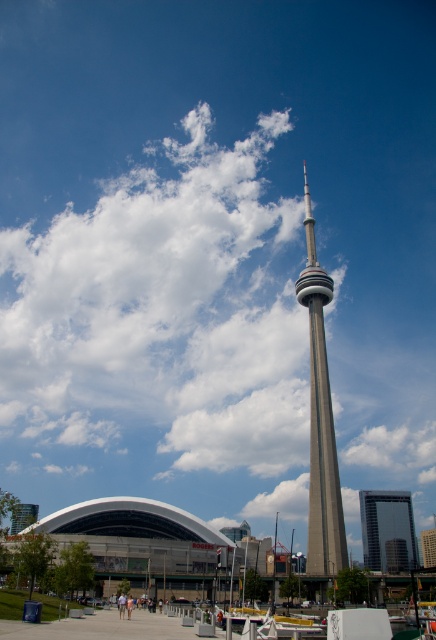
Does white fluffy cloud at upper center have a smaller size compared to silver metallic cn tower at center?

No.

How distant is white fluffy cloud at upper center from silver metallic cn tower at center?

white fluffy cloud at upper center is 63.32 meters away from silver metallic cn tower at center.

Image resolution: width=436 pixels, height=640 pixels. What do you see at coordinates (164, 333) in the screenshot? I see `white fluffy cloud at upper center` at bounding box center [164, 333].

Locate an element on the screen. The width and height of the screenshot is (436, 640). white fluffy cloud at upper center is located at coordinates 164,333.

Is point (329, 436) closer to viewer compared to point (404, 564)?

Yes, it is.

Locate an element on the screen. silver metallic cn tower at center is located at coordinates (320, 420).

Is white fluffy cloud at upper center above glassy reflective skyscraper at center?

Yes.

Who is shorter, white fluffy cloud at upper center or glassy reflective skyscraper at center?

glassy reflective skyscraper at center is shorter.

Who is more distant from viewer, [130,353] or [411,529]?

The point [411,529] is behind.

This screenshot has height=640, width=436. I want to click on white fluffy cloud at upper center, so click(164, 333).